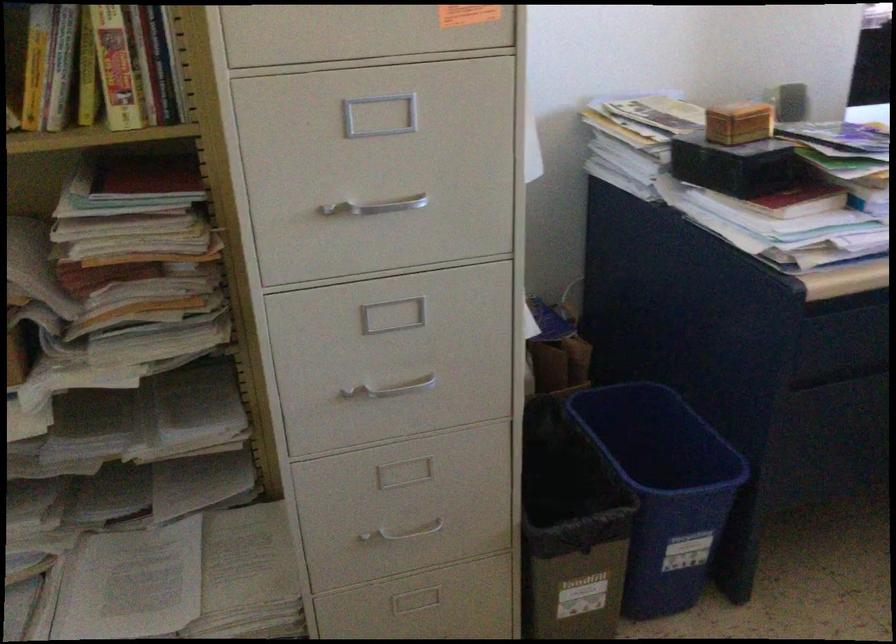
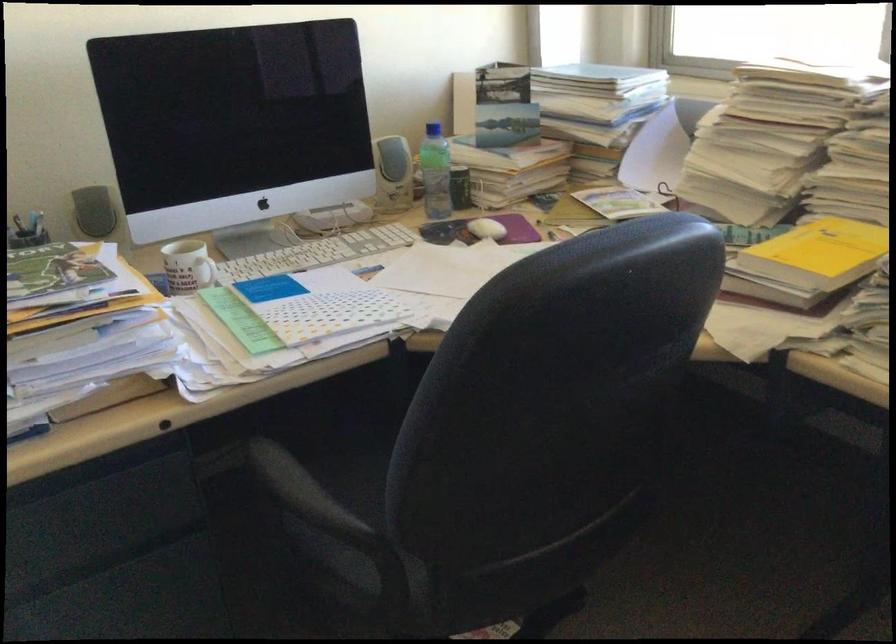
Find the pixel in the second image that matches the point at 797,102 in the first image.

(93, 211)